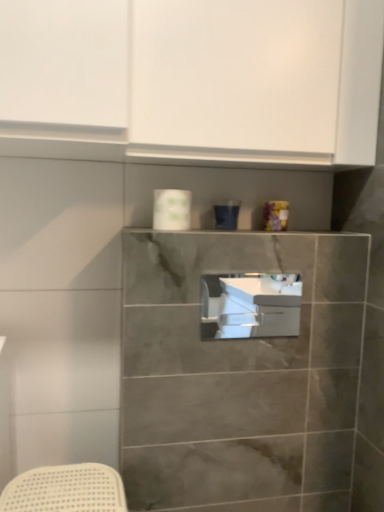
The height and width of the screenshot is (512, 384). What do you see at coordinates (256, 81) in the screenshot?
I see `white matte cabinet at upper center` at bounding box center [256, 81].

Where is `white glossy sink at center`? This screenshot has height=512, width=384. white glossy sink at center is located at coordinates (250, 305).

Find the location of a particular element. white matte cabinet at upper center is located at coordinates (256, 81).

Looking at this image, does white glossy sink at center turn towards white glossy toilet paper at upper center?

No, white glossy sink at center is not turned towards white glossy toilet paper at upper center.

Who is shorter, white glossy sink at center or white glossy toilet paper at upper center?

white glossy toilet paper at upper center.

Is white glossy sink at center positioned in front of white glossy toilet paper at upper center?

That is True.

Locate an element on the screen. The width and height of the screenshot is (384, 512). sink below the white glossy toilet paper at upper center (from the image's perspective) is located at coordinates (250, 305).

Which is more to the left, white matte cabinet at upper center or white glossy toilet paper at upper center?

Positioned to the left is white glossy toilet paper at upper center.

The image size is (384, 512). What are the coordinates of `toilet paper on the left side of white matte cabinet at upper center` in the screenshot? It's located at (172, 209).

Considering the points (329, 53) and (172, 202), which point is in front, point (329, 53) or point (172, 202)?

The point (329, 53) is closer.

Which of these two, white matte cabinet at upper center or white glossy toilet paper at upper center, stands shorter?

white glossy toilet paper at upper center is shorter.

From a real-world perspective, is white glossy sink at center located higher than white matte cabinet at upper center?

No, from a real-world perspective, white glossy sink at center is not on top of white matte cabinet at upper center.

This screenshot has height=512, width=384. I want to click on cabinetry above the white glossy sink at center (from a real-world perspective), so click(256, 81).

Can you confirm if white glossy sink at center is positioned to the left of white matte cabinet at upper center?

No.

Is white glossy sink at center bigger or smaller than white matte cabinet at upper center?

Clearly, white glossy sink at center is smaller in size than white matte cabinet at upper center.

Which of these two, white matte cabinet at upper center or white glossy sink at center, stands taller?

white matte cabinet at upper center.

From the image's perspective, is white matte cabinet at upper center under white glossy sink at center?

No.

Is white matte cabinet at upper center directly adjacent to white glossy sink at center?

white matte cabinet at upper center and white glossy sink at center are not in contact.

Considering the relative sizes of white matte cabinet at upper center and white glossy sink at center in the image provided, is white matte cabinet at upper center bigger than white glossy sink at center?

Yes.

From a real-world perspective, is white glossy toilet paper at upper center located higher than white matte cabinet at upper center?

Incorrect, from a real-world perspective, white glossy toilet paper at upper center is lower than white matte cabinet at upper center.

Who is taller, white glossy toilet paper at upper center or white matte cabinet at upper center?

white matte cabinet at upper center.

From the image's perspective, is white glossy toilet paper at upper center above white matte cabinet at upper center?

No.

From the image's perspective, which is above, white glossy toilet paper at upper center or white glossy sink at center?

From the image's view, white glossy toilet paper at upper center is above.

Would you consider white glossy toilet paper at upper center to be distant from white glossy sink at center?

white glossy toilet paper at upper center is near white glossy sink at center, not far away.

Image resolution: width=384 pixels, height=512 pixels. I want to click on sink on the right of white glossy toilet paper at upper center, so click(x=250, y=305).

Consider the image. Considering the relative positions of white glossy toilet paper at upper center and white glossy sink at center in the image provided, is white glossy toilet paper at upper center to the left or to the right of white glossy sink at center?

From the image, it's evident that white glossy toilet paper at upper center is to the left of white glossy sink at center.

Where is `toilet paper above the white glossy sink at center (from the image's perspective)`? The width and height of the screenshot is (384, 512). toilet paper above the white glossy sink at center (from the image's perspective) is located at coordinates (172, 209).

I want to click on toilet paper below the white matte cabinet at upper center (from a real-world perspective), so click(172, 209).

Based on the photo, from the image, which object appears to be nearer to white glossy toilet paper at upper center, white matte cabinet at upper center or white glossy sink at center?

white matte cabinet at upper center lies closer to white glossy toilet paper at upper center than the other object.

Which object lies further to the anchor point white matte cabinet at upper center, white glossy sink at center or white glossy toilet paper at upper center?

white glossy sink at center is further to white matte cabinet at upper center.

Based on their spatial positions, is white glossy toilet paper at upper center or white matte cabinet at upper center closer to white glossy sink at center?

Based on the image, white glossy toilet paper at upper center appears to be nearer to white glossy sink at center.

Based on their spatial positions, is white glossy toilet paper at upper center or white glossy sink at center further from white matte cabinet at upper center?

Based on the image, white glossy sink at center appears to be further to white matte cabinet at upper center.

Considering their positions, is white matte cabinet at upper center positioned closer to white glossy sink at center than white glossy toilet paper at upper center?

white glossy toilet paper at upper center is positioned closer to the anchor white glossy sink at center.

Based on their spatial positions, is white glossy sink at center or white matte cabinet at upper center closer to white glossy toilet paper at upper center?

The object closer to white glossy toilet paper at upper center is white matte cabinet at upper center.

Image resolution: width=384 pixels, height=512 pixels. Find the location of `toilet paper between white matte cabinet at upper center and white glossy sink at center in the vertical direction`. toilet paper between white matte cabinet at upper center and white glossy sink at center in the vertical direction is located at coordinates (172, 209).